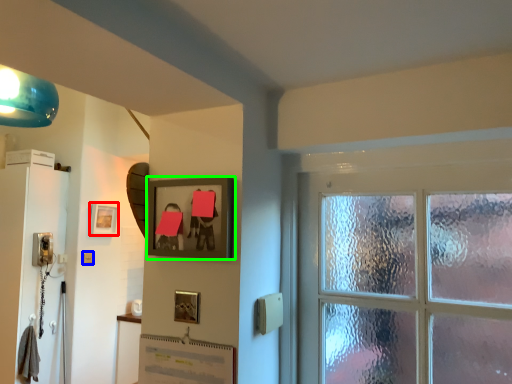
Question: Estimate the real-world distances between objects in this image. Which object is closer to picture frame (highlighted by a red box), light switch (highlighted by a blue box) or picture frame (highlighted by a green box)?

Choices:
 (A) light switch
 (B) picture frame

Answer: (A)